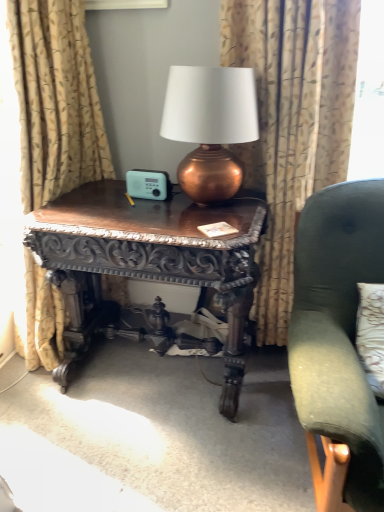
Question: Considering the positions of dark wood carved table at center and velvet green armchair at right in the image, is dark wood carved table at center wider or thinner than velvet green armchair at right?

Choices:
 (A) thin
 (B) wide

Answer: (A)

Question: Visually, is dark wood carved table at center positioned to the left or to the right of velvet green armchair at right?

Choices:
 (A) right
 (B) left

Answer: (B)

Question: Considering the real-world distances, which object is farthest from the copper metallic lamp at center?

Choices:
 (A) velvet green armchair at right
 (B) dark wood carved table at center
 (C) patterned fabric curtain at center, which is the 2th curtain in left-to-right order
 (D) gold textured curtain at left, positioned as the first curtain in left-to-right order

Answer: (D)

Question: Which is nearer to the patterned fabric curtain at center, the 1th curtain from the right?

Choices:
 (A) copper metallic lamp at center
 (B) dark wood carved table at center
 (C) gold textured curtain at left, the 2th curtain in the right-to-left sequence
 (D) velvet green armchair at right

Answer: (A)